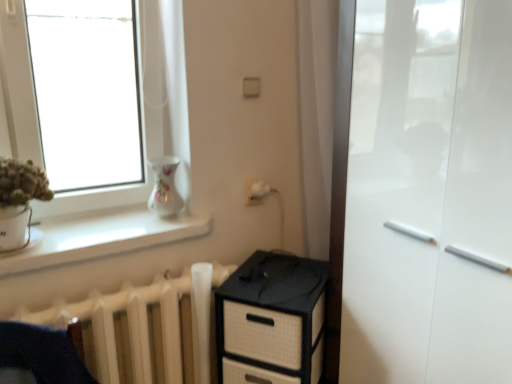
Question: Can you confirm if white matte radiator at lower left is positioned to the left of black woven chest of drawers at lower center?

Choices:
 (A) yes
 (B) no

Answer: (A)

Question: Does white matte radiator at lower left have a greater height compared to black woven chest of drawers at lower center?

Choices:
 (A) yes
 (B) no

Answer: (B)

Question: Is the depth of white matte radiator at lower left greater than that of black woven chest of drawers at lower center?

Choices:
 (A) no
 (B) yes

Answer: (A)

Question: Does white matte radiator at lower left appear on the right side of black woven chest of drawers at lower center?

Choices:
 (A) no
 (B) yes

Answer: (A)

Question: Are white matte radiator at lower left and black woven chest of drawers at lower center far apart?

Choices:
 (A) yes
 (B) no

Answer: (B)

Question: Is white matte radiator at lower left positioned with its back to black woven chest of drawers at lower center?

Choices:
 (A) no
 (B) yes

Answer: (A)

Question: From a real-world perspective, is porcelain floral vase at upper left on top of white matte radiator at lower left?

Choices:
 (A) yes
 (B) no

Answer: (A)

Question: Is porcelain floral vase at upper left oriented towards white matte radiator at lower left?

Choices:
 (A) no
 (B) yes

Answer: (A)

Question: Would you consider porcelain floral vase at upper left to be distant from white matte radiator at lower left?

Choices:
 (A) no
 (B) yes

Answer: (A)

Question: Does porcelain floral vase at upper left have a lesser width compared to white matte radiator at lower left?

Choices:
 (A) yes
 (B) no

Answer: (A)

Question: Can white matte radiator at lower left be found inside porcelain floral vase at upper left?

Choices:
 (A) yes
 (B) no

Answer: (B)

Question: Can you confirm if porcelain floral vase at upper left is taller than white matte radiator at lower left?

Choices:
 (A) no
 (B) yes

Answer: (A)

Question: Is white smooth window sill at lower left facing away from white glossy cabinet at right?

Choices:
 (A) no
 (B) yes

Answer: (A)